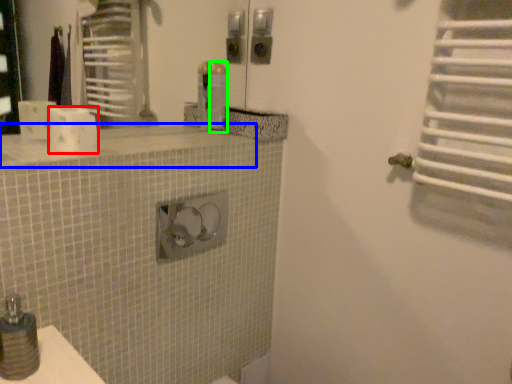
Question: Which is nearer to the toilet paper (highlighted by a red box)? counter top (highlighted by a blue box) or toiletry (highlighted by a green box).

Choices:
 (A) counter top
 (B) toiletry

Answer: (A)